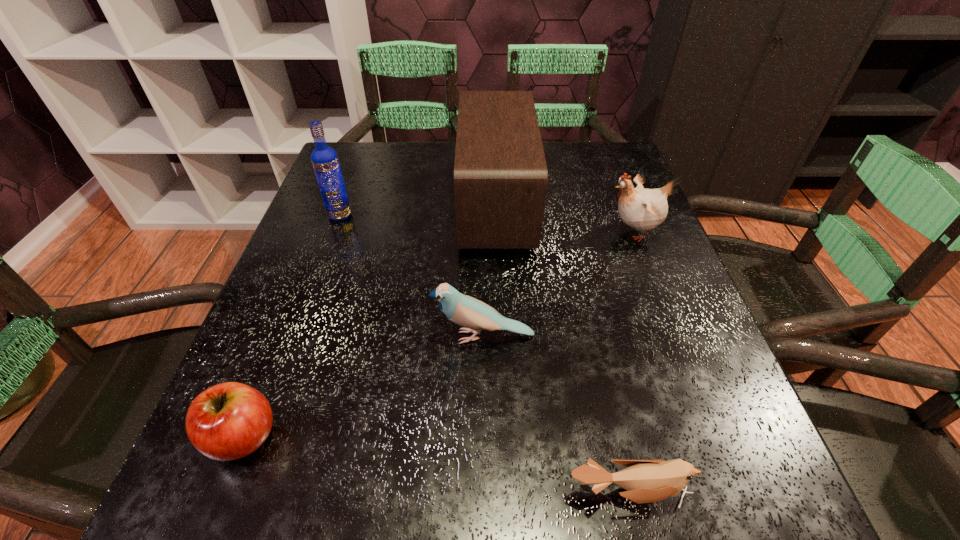
Find the location of a particular element. free space located on the front-facing side of the radio receiver is located at coordinates (422, 206).

You are a GUI agent. You are given a task and a screenshot of the screen. Output one action in this format:
    pyautogui.click(x=<x>, y=<y>)
    Task: Click on the vacant region located 0.070m on the front-facing side of the radio receiver
    This screenshot has width=960, height=540.
    Given the screenshot: What is the action you would take?
    pyautogui.click(x=431, y=206)

Image resolution: width=960 pixels, height=540 pixels. What are the coordinates of `vacant area situated 0.150m on the front-facing side of the radio receiver` in the screenshot? It's located at (397, 206).

This screenshot has width=960, height=540. Identify the location of vacant space located 0.320m at the beak of the farthest bird. (460, 232).

Locate an element on the screen. The image size is (960, 540). vacant space located at the beak of the farthest bird is located at coordinates (523, 232).

Locate an element on the screen. This screenshot has width=960, height=540. vacant area situated 0.350m at the beak of the farthest bird is located at coordinates (445, 232).

Locate an element on the screen. This screenshot has width=960, height=540. free space located 0.070m at the face of the fourth farthest object is located at coordinates (389, 336).

The image size is (960, 540). In order to click on vacant space situated 0.290m at the face of the fourth farthest object in this screenshot , I will do (x=262, y=336).

What are the coordinates of `blank space located at the face of the fourth farthest object` in the screenshot? It's located at (279, 336).

Image resolution: width=960 pixels, height=540 pixels. In order to click on vacant area located on the back of the fifth farthest object in this screenshot , I will do `click(276, 351)`.